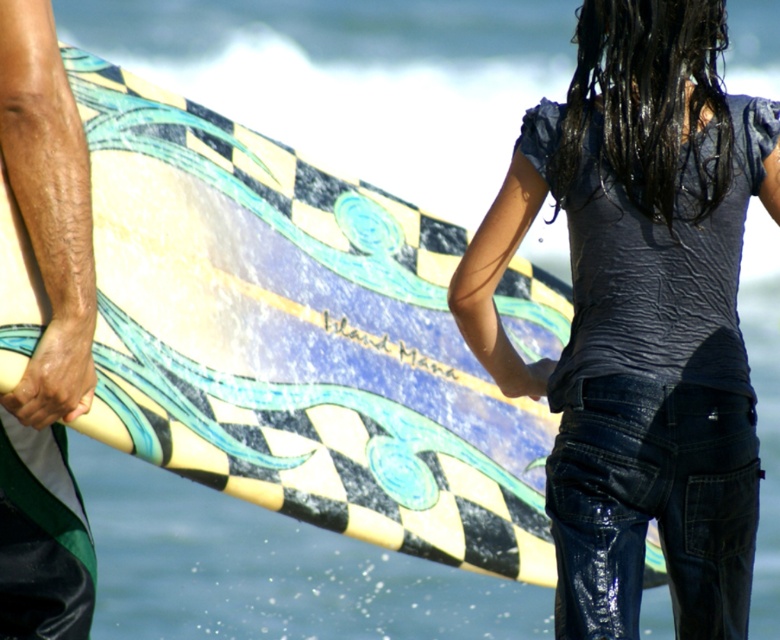
Question: Which point is closer to the camera?

Choices:
 (A) denim jeans at center
 (B) checkered fabric surfboard at center

Answer: (B)

Question: Does checkered fabric surfboard at center appear on the right side of matte black surfboard at lower left?

Choices:
 (A) yes
 (B) no

Answer: (B)

Question: Considering the relative positions of denim jeans at center and matte black surfboard at lower left in the image provided, where is denim jeans at center located with respect to matte black surfboard at lower left?

Choices:
 (A) left
 (B) right

Answer: (B)

Question: Among these objects, which one is farthest from the camera?

Choices:
 (A) matte green surfboard at left
 (B) denim jeans at center
 (C) matte black surfboard at lower left
 (D) checkered fabric surfboard at center

Answer: (C)

Question: Can you confirm if denim jeans at center is bigger than smooth tan skin at lower left?

Choices:
 (A) no
 (B) yes

Answer: (B)

Question: Which point is closer to the camera?

Choices:
 (A) (431, 342)
 (B) (78, 388)
 (C) (52, 388)
 (D) (690, 444)

Answer: (B)